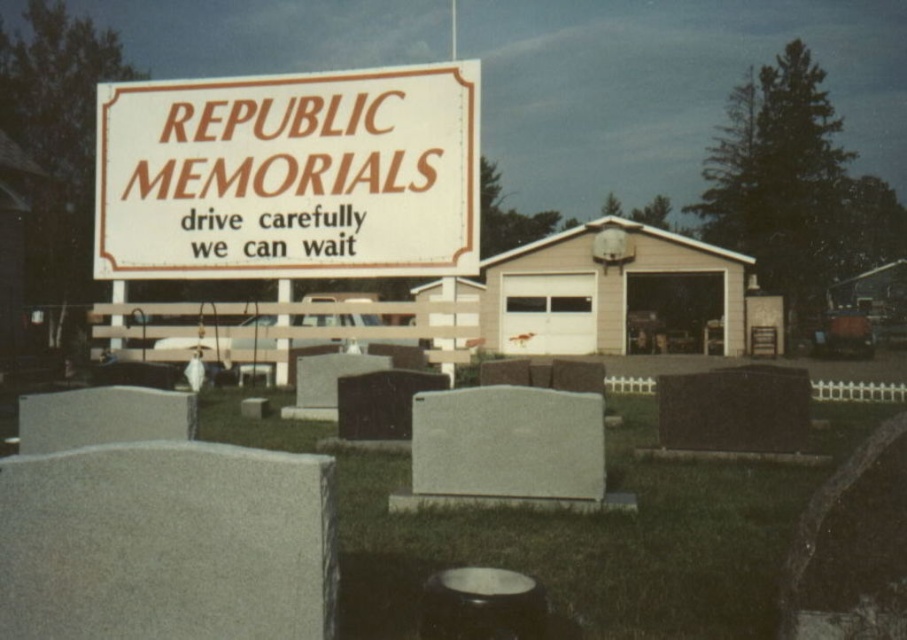
Does white plastic sign at upper center have a lesser width compared to gray granite gravestone at center?

Yes.

Is white plastic sign at upper center wider than gray granite gravestone at center?

A: No.

Is point (252, 253) positioned before point (479, 396)?

No, it is behind (479, 396).

Where is `white plastic sign at upper center`? white plastic sign at upper center is located at coordinates (289, 176).